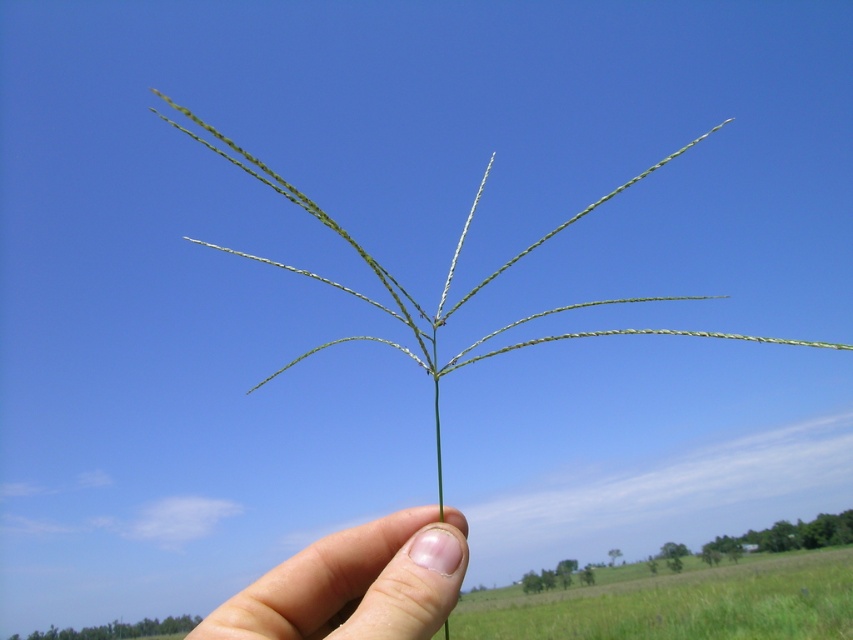
Is green matte grass at center wider than smooth skin at center?

Indeed, green matte grass at center has a greater width compared to smooth skin at center.

What do you see at coordinates (685, 604) in the screenshot? The height and width of the screenshot is (640, 853). I see `green matte grass at center` at bounding box center [685, 604].

Between point (524, 630) and point (436, 598), which one is positioned in front?

Positioned in front is point (436, 598).

Find the location of a particular element. green matte grass at center is located at coordinates (685, 604).